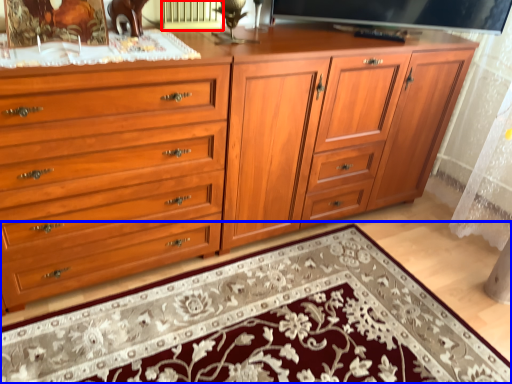
Question: Which point is further to the camera, radiator (highlighted by a red box) or mat (highlighted by a blue box)?

Choices:
 (A) radiator
 (B) mat

Answer: (A)